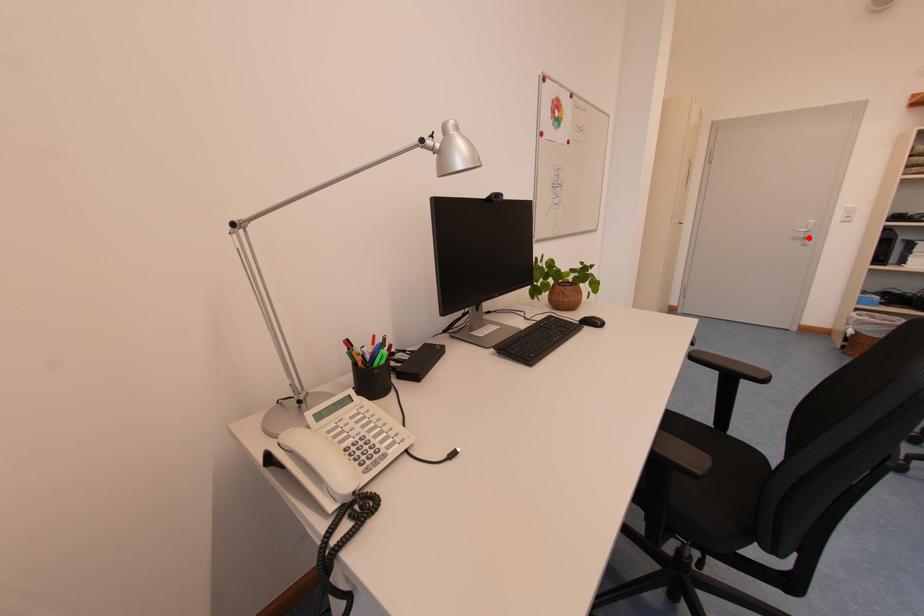
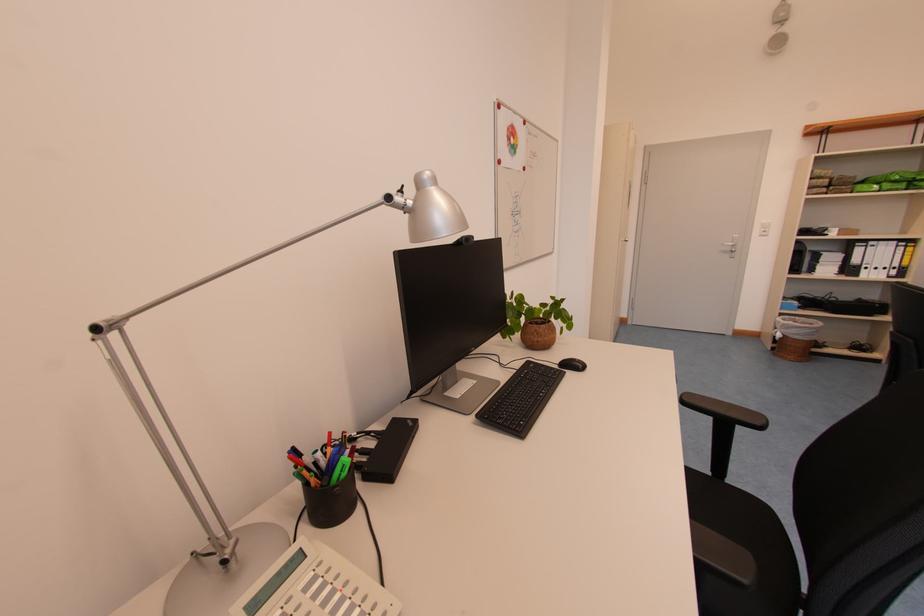
Question: I am providing you with two images of the same scene from different viewpoints. Image1 has a red point marked. In image2, the corresponding 3D location appears at what relative position? Reply with the corresponding letter.

Choices:
 (A) Closer
 (B) Farther

Answer: (A)